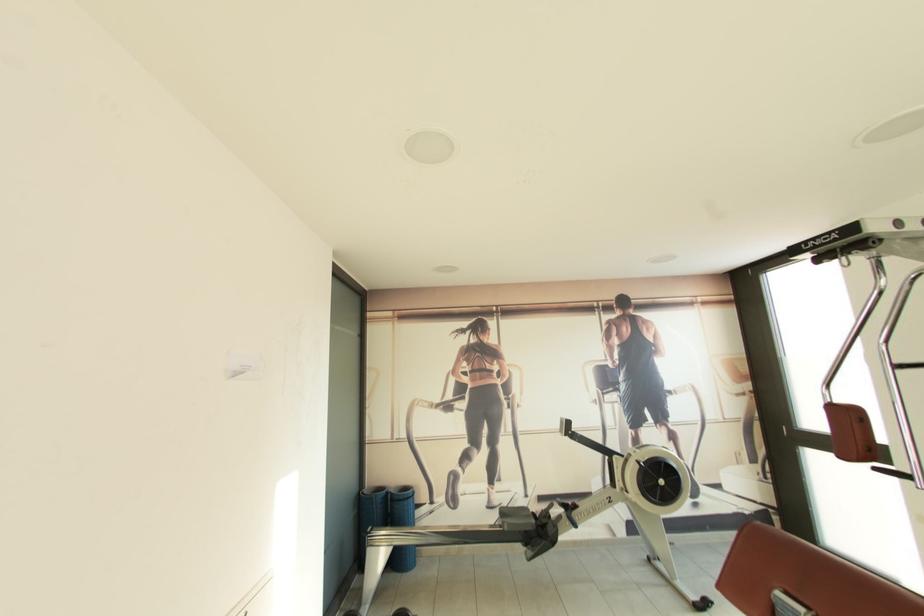
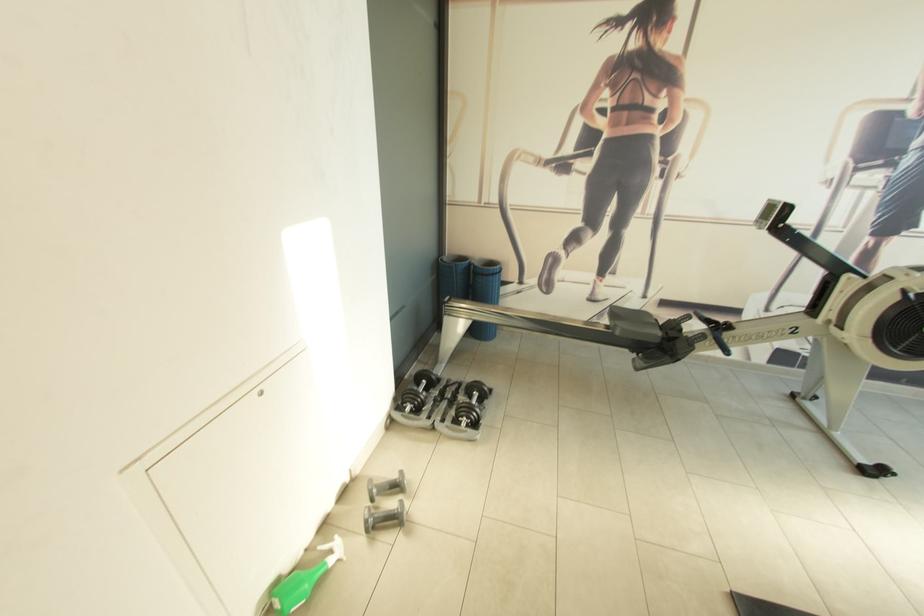
Where in the second image is the point corresponding to (371,493) from the first image?

(451, 261)